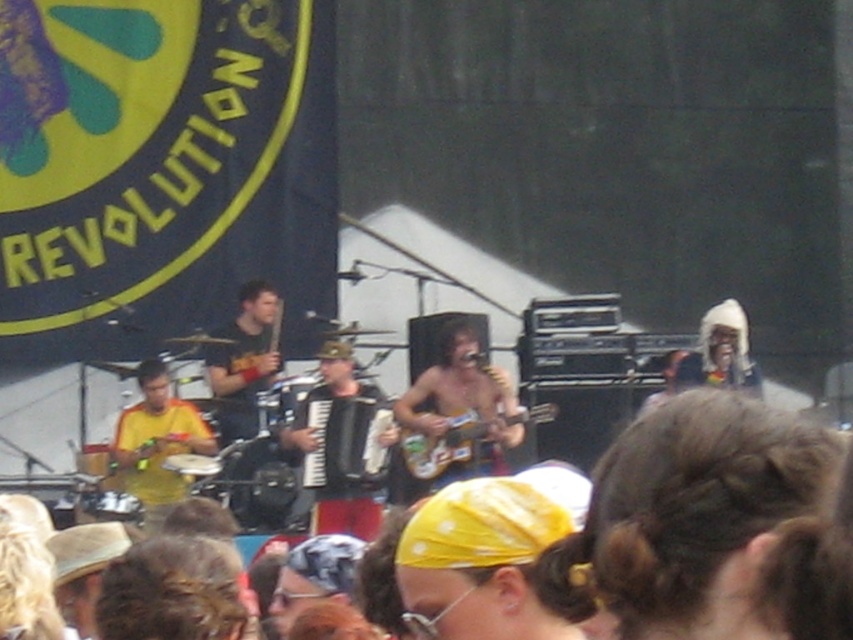
You are a photographer at the music event and want to take a photo of the yellow matte shirt at left and the glossy wood guitar at center. Which object is closer to you, the photographer?

The yellow matte shirt at left is closer to you because it is further to the viewer than the glossy wood guitar at center.

You are a photographer standing at the back of the crowd. You want to take a photo that includes both the shiny gold guitar at center and the yellow matte shirt at left. Given that your camera has a maximum focus range of 6 meters, will you be able to capture both objects in focus if they are 5.96 meters apart?

The shiny gold guitar at center and the yellow matte shirt at left are 5.96 meters apart from each other. Since the distance between them is within the camera maximum focus range of 6 meters, the photographer can capture both objects in focus.

You are a photographer at the music event and want to capture a photo where the shiny gold guitar at center and the yellow matte shirt at left are both visible. Since the guitar is taller than the shirt, how should you adjust your camera angle to ensure both are fully visible in the frame?

To capture both the shiny gold guitar at center and the yellow matte shirt at left, tilt the camera slightly downward to accommodate the guitar height while keeping the shirt in view.